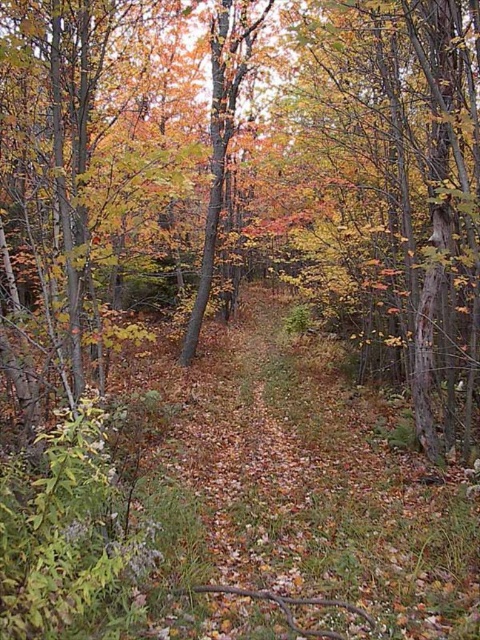
Question: Can you confirm if yellowish-brown bark tree at center is positioned to the right of orange-brown bark tree at center?

Choices:
 (A) no
 (B) yes

Answer: (B)

Question: Which of the following is the closest to the observer?

Choices:
 (A) orange-brown bark tree at center
 (B) yellowish-brown bark tree at center

Answer: (B)

Question: Which of the following is the closest to the observer?

Choices:
 (A) (348, 243)
 (B) (208, 220)

Answer: (A)

Question: Is yellowish-brown bark tree at center closer to the viewer compared to orange-brown bark tree at center?

Choices:
 (A) no
 (B) yes

Answer: (B)

Question: Observing the image, what is the correct spatial positioning of yellowish-brown bark tree at center in reference to orange-brown bark tree at center?

Choices:
 (A) above
 (B) below

Answer: (B)

Question: Which of the following is the farthest from the observer?

Choices:
 (A) yellowish-brown bark tree at center
 (B) orange-brown bark tree at center

Answer: (B)